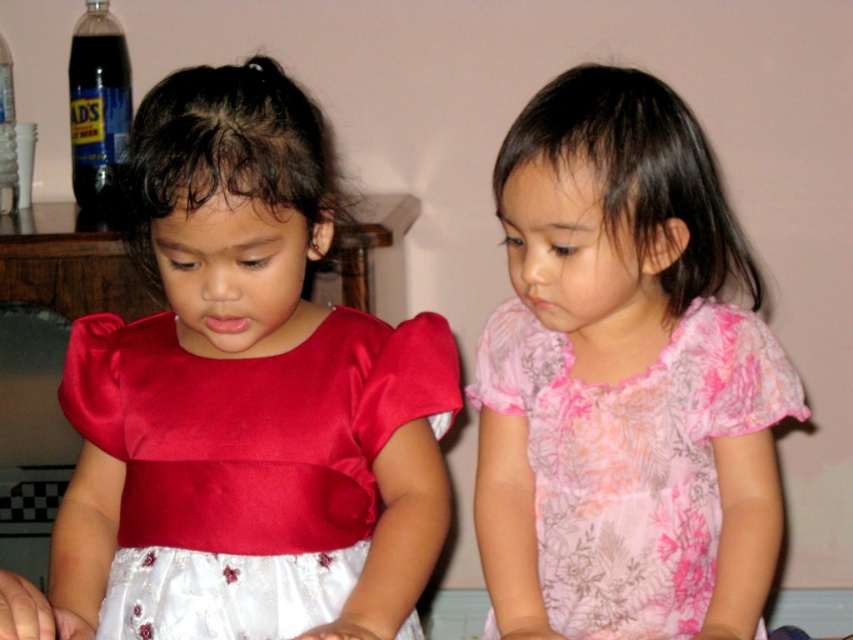
Question: Which point appears farthest from the camera in this image?

Choices:
 (A) (709, 352)
 (B) (209, 481)

Answer: (B)

Question: Does satin dress at left have a larger size compared to pink floral fabric dress at right?

Choices:
 (A) yes
 (B) no

Answer: (B)

Question: Does satin dress at left have a greater width compared to pink floral fabric dress at right?

Choices:
 (A) no
 (B) yes

Answer: (B)

Question: Is satin dress at left wider than pink floral fabric dress at right?

Choices:
 (A) no
 (B) yes

Answer: (B)

Question: Which point is farther to the camera?

Choices:
 (A) (173, 317)
 (B) (544, 420)

Answer: (A)